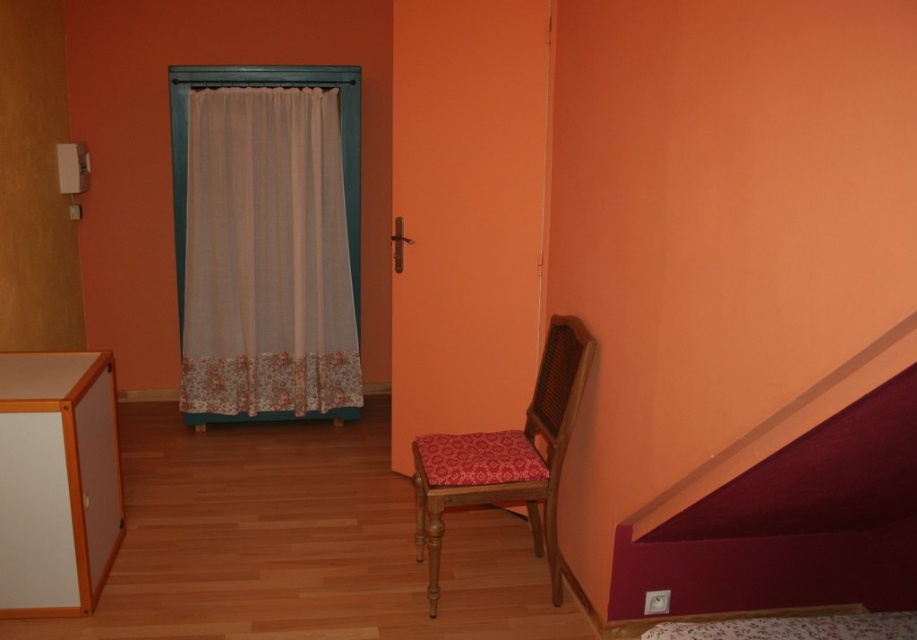
Question: Among these objects, which one is farthest from the camera?

Choices:
 (A) floral fabric bed at lower right
 (B) wooden chair with patterned seat cushion at lower right
 (C) orange wood cabinet at lower left
 (D) sheer fabric curtain at left

Answer: (D)

Question: Which of the following is the closest to the observer?

Choices:
 (A) wooden chair with patterned seat cushion at lower right
 (B) orange wood cabinet at lower left
 (C) maroon fabric stair at lower right
 (D) floral fabric bed at lower right

Answer: (C)

Question: Observing the image, what is the correct spatial positioning of wooden chair with patterned seat cushion at lower right in reference to floral fabric bed at lower right?

Choices:
 (A) below
 (B) above

Answer: (B)

Question: Estimate the real-world distances between objects in this image. Which object is farther from the floral fabric bed at lower right?

Choices:
 (A) wooden chair with patterned seat cushion at lower right
 (B) maroon fabric stair at lower right
 (C) sheer fabric curtain at left

Answer: (C)

Question: Can you confirm if sheer fabric curtain at left is bigger than floral fabric bed at lower right?

Choices:
 (A) yes
 (B) no

Answer: (A)

Question: Can you confirm if sheer fabric curtain at left is wider than wooden chair with patterned seat cushion at lower right?

Choices:
 (A) no
 (B) yes

Answer: (B)